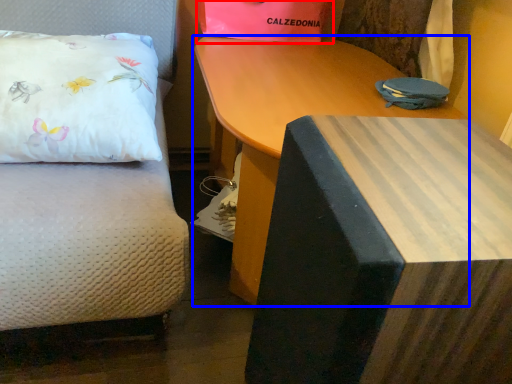
Question: Which object appears closest to the camera in this image, gift bag (highlighted by a red box) or table (highlighted by a blue box)?

Choices:
 (A) gift bag
 (B) table

Answer: (B)